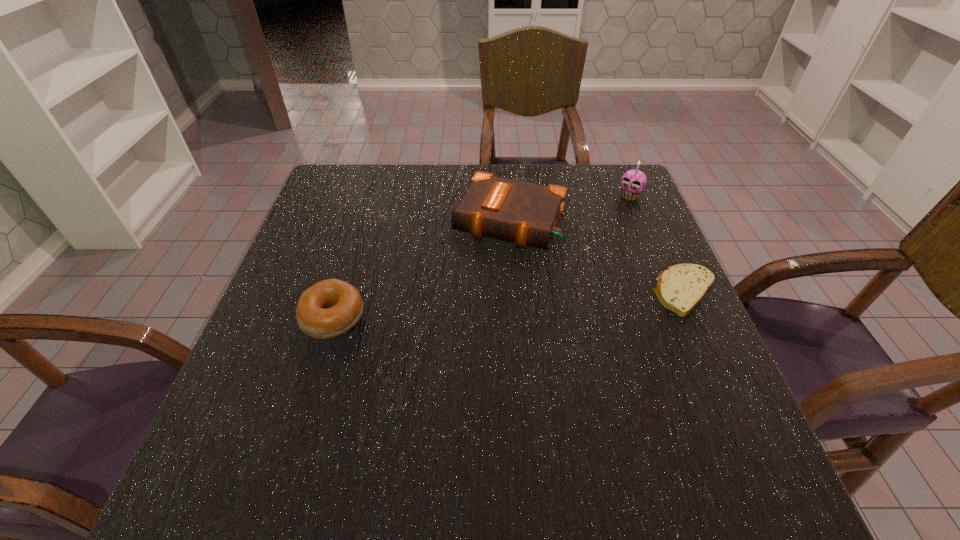
Identify the location of vacant spot on the desktop that is between the second shortest object and the shortest object and is positioned on the face of the cupcake. (545, 303).

You are a GUI agent. You are given a task and a screenshot of the screen. Output one action in this format:
    pyautogui.click(x=<x>, y=<y>)
    Task: Click on the vacant space on the desktop that is between the bagel and the shortest object and is positioned on the spine side of the second object from left to right
    The image size is (960, 540).
    Given the screenshot: What is the action you would take?
    pyautogui.click(x=468, y=308)